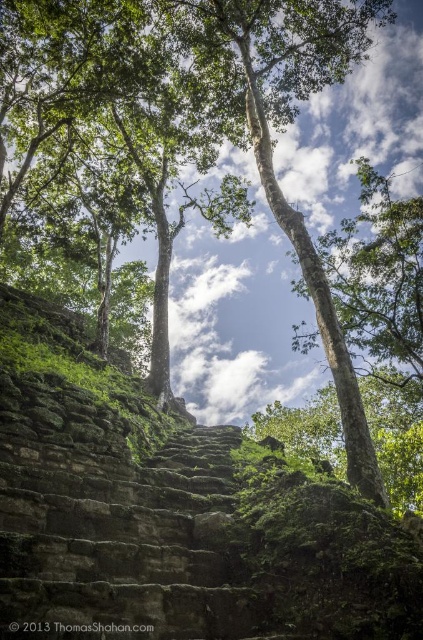
Is green mossy stone steps at center behind green mossy stone stairs at center?

That is False.

Between point (277, 500) and point (219, 582), which one is positioned in front?

Point (219, 582) is more forward.

This screenshot has width=423, height=640. Describe the element at coordinates (172, 516) in the screenshot. I see `green mossy stone steps at center` at that location.

Locate an element on the screen. green mossy stone steps at center is located at coordinates (172, 516).